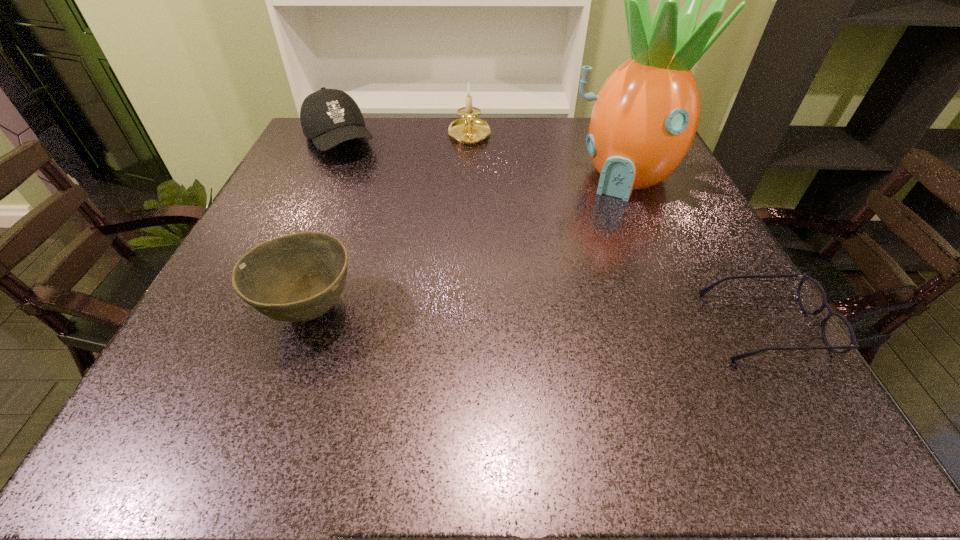
Locate an element on the screen. unoccupied area between the baseball cap and the candle holder is located at coordinates (404, 139).

This screenshot has height=540, width=960. What are the coordinates of `vacant area between the baseball cap and the third object from left to right` in the screenshot? It's located at (404, 139).

Find the location of a particular element. free area in between the bowl and the third object from right to left is located at coordinates (390, 224).

Image resolution: width=960 pixels, height=540 pixels. In order to click on object that stands as the third closest to the spectacles in this screenshot , I will do `click(469, 130)`.

Where is `the fourth closest object to the pineapple`? The image size is (960, 540). the fourth closest object to the pineapple is located at coordinates (329, 117).

Locate an element on the screen. The height and width of the screenshot is (540, 960). vacant point that satisfies the following two spatial constraints: 1. on the front side of the pineapple; 2. on the left side of the baseball cap is located at coordinates (324, 176).

Locate an element on the screen. vacant position in the image that satisfies the following two spatial constraints: 1. on the front side of the bowl; 2. on the right side of the baseball cap is located at coordinates (262, 310).

Locate an element on the screen. The width and height of the screenshot is (960, 540). free space that satisfies the following two spatial constraints: 1. on the front side of the bowl; 2. on the front-facing side of the shortest object is located at coordinates (304, 326).

Identify the location of vacant region that satisfies the following two spatial constraints: 1. on the front side of the third object from left to right; 2. on the front-facing side of the shortest object. The height and width of the screenshot is (540, 960). (463, 326).